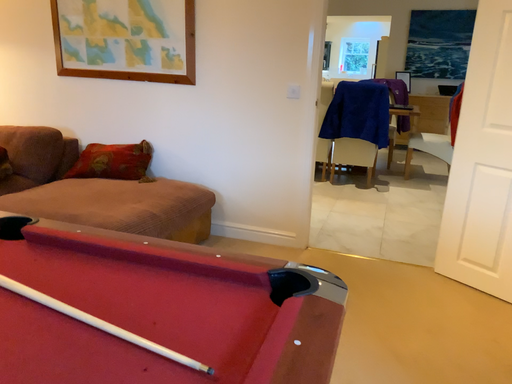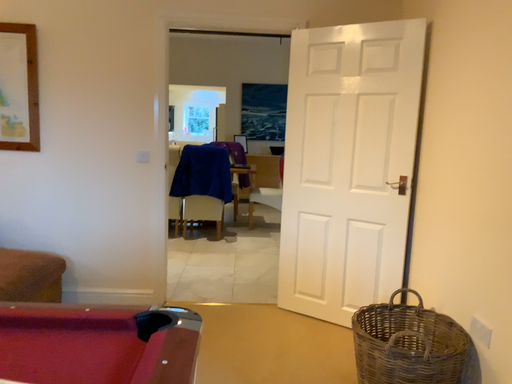
Question: Which way did the camera rotate in the video?

Choices:
 (A) rotated upward
 (B) rotated downward

Answer: (A)